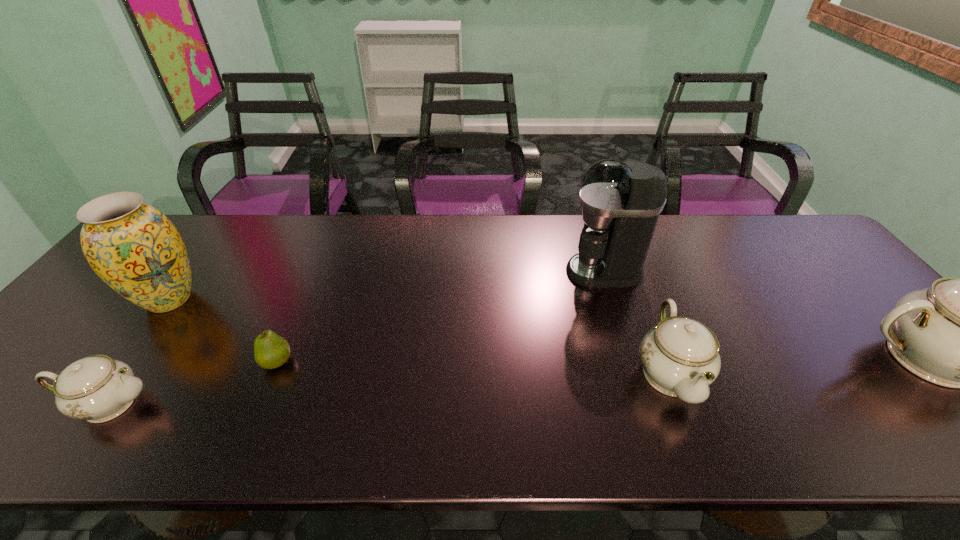
Where is `the fourth closest object to the fifth shortest object`? the fourth closest object to the fifth shortest object is located at coordinates (680, 356).

Point out which object is positioned as the fourth nearest to the shortest object. Please provide its 2D coordinates. Your answer should be formatted as a tuple, i.e. [(x, y)], where the tuple contains the x and y coordinates of a point satisfying the conditions above.

[(680, 356)]

Point out which chinaware is positioned as the nearest to the shortest chinaware. Please provide its 2D coordinates. Your answer should be formatted as a tuple, i.e. [(x, y)], where the tuple contains the x and y coordinates of a point satisfying the conditions above.

[(680, 356)]

The height and width of the screenshot is (540, 960). Find the location of `chinaware that stands as the second closest to the second shortest object`. chinaware that stands as the second closest to the second shortest object is located at coordinates coord(959,333).

I want to click on vacant space that satisfies the following two spatial constraints: 1. at the spout of the second shortest chinaware; 2. at the spout of the fifth tallest object, so click(681, 403).